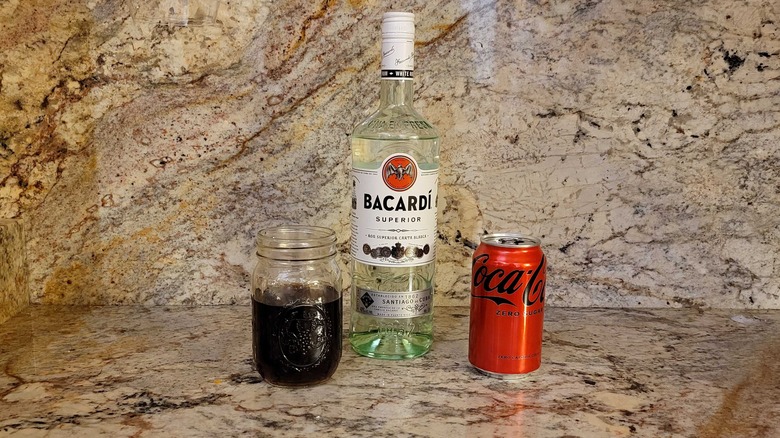
At what (x,y) coordinates should I click in order to perform the action: click on jar. Please return your answer as a coordinate pair (x, y). The image size is (780, 438). Looking at the image, I should click on click(285, 318).